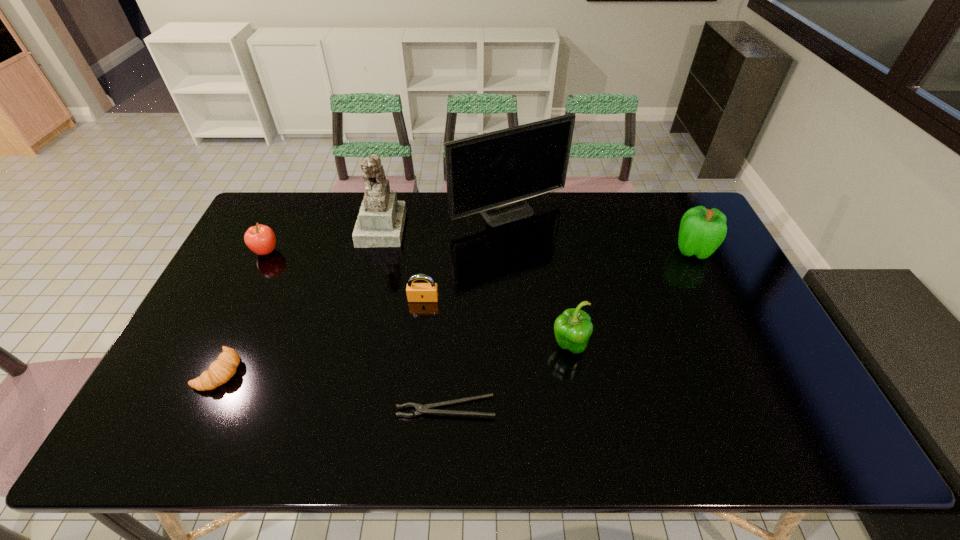
Identify the location of object that is at the near edge. The width and height of the screenshot is (960, 540). (421, 409).

I want to click on apple that is at the left edge, so click(x=260, y=239).

Identify the location of crescent roll at the left edge. This screenshot has width=960, height=540. click(x=220, y=371).

Where is `object that is positioned at the right edge`? object that is positioned at the right edge is located at coordinates (x=702, y=231).

This screenshot has width=960, height=540. What are the coordinates of `vacant space at the far edge` in the screenshot? It's located at (340, 206).

Where is `vacant space at the near edge of the desktop`? vacant space at the near edge of the desktop is located at coordinates (716, 451).

The height and width of the screenshot is (540, 960). In the image, there is a desktop. Identify the location of vacant area at the left edge. (245, 328).

Image resolution: width=960 pixels, height=540 pixels. What are the coordinates of `vacant space at the right edge of the desktop` in the screenshot? It's located at (725, 361).

In the image, there is a desktop. Where is `blank space at the far left corner`? blank space at the far left corner is located at coordinates (295, 196).

I want to click on vacant space at the far right corner of the desktop, so click(676, 211).